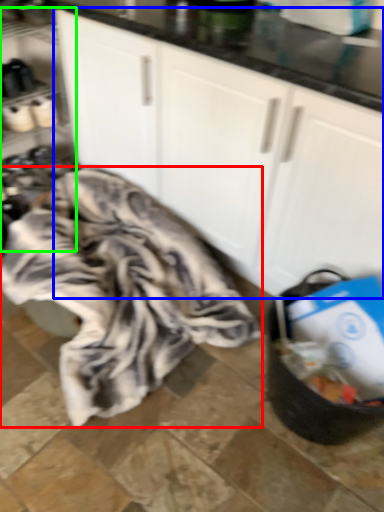
Question: Which object is the farthest from blanket (highlighted by a red box)? Choose among these: cabinetry (highlighted by a blue box) or shelf (highlighted by a green box).

Choices:
 (A) cabinetry
 (B) shelf

Answer: (B)